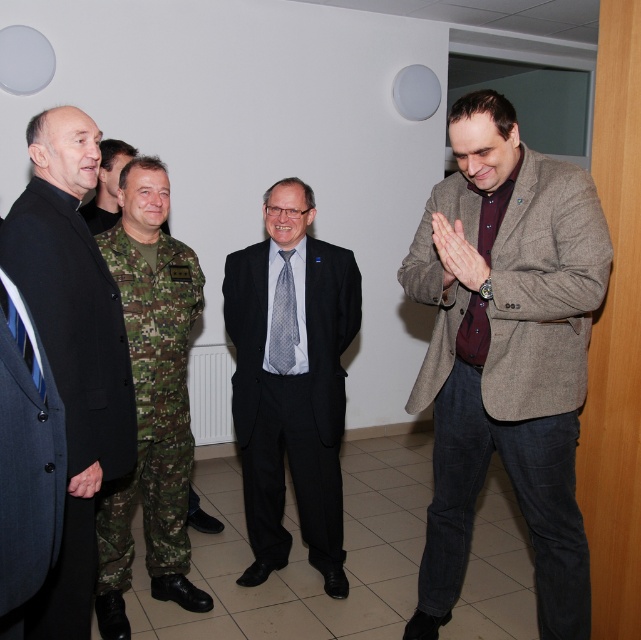
In the scene shown: You are an interior designer assessing the spatial compatibility of two suits displayed in a modern office. The dark gray suit at center and the dark blue suit at left are both part of the decor. Can you determine which suit is taller?

The dark gray suit at center is taller than the dark blue suit at left.

Is the dark gray suit at center located to the left or right of the point at (292,381)?

The dark gray suit at center is located at the point at (292,381).